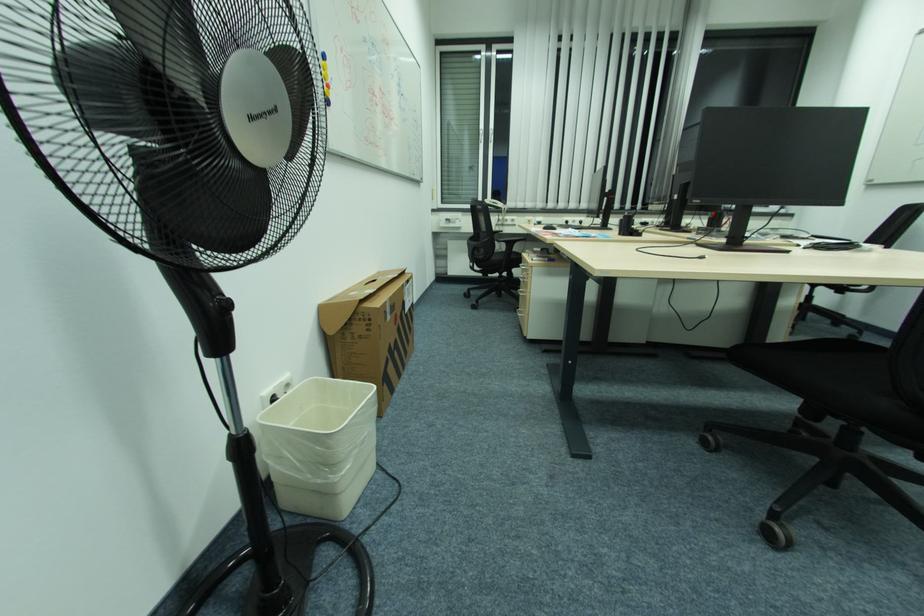
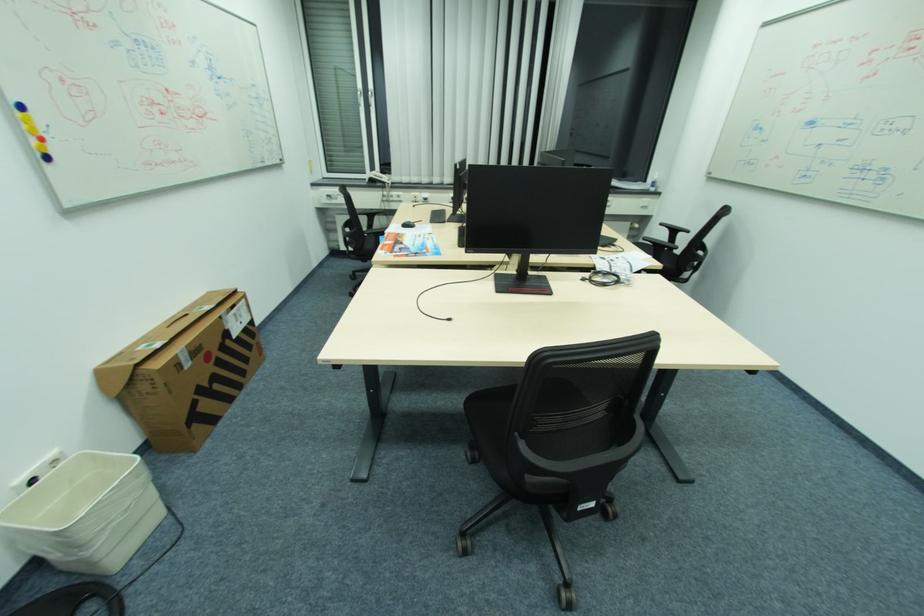
Find the pixel in the second image that matches the point at 391,302 in the first image.

(181, 355)